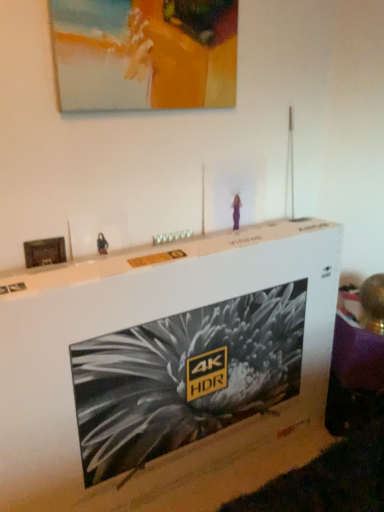
Question: Could matte acrylic painting at upper center, marked as the 1th picture frame in a right-to-left arrangement, be considered to be inside white cardboard box at center?

Choices:
 (A) yes
 (B) no

Answer: (B)

Question: From a real-world perspective, is white cardboard box at center physically below matte acrylic painting at upper center, the 2th picture frame in the left-to-right sequence?

Choices:
 (A) no
 (B) yes

Answer: (B)

Question: Is white cardboard box at center directly adjacent to matte acrylic painting at upper center, the 2th picture frame in the left-to-right sequence?

Choices:
 (A) no
 (B) yes

Answer: (A)

Question: Does white cardboard box at center have a lesser width compared to matte acrylic painting at upper center, the 2th picture frame in the left-to-right sequence?

Choices:
 (A) yes
 (B) no

Answer: (B)

Question: Is the depth of white cardboard box at center greater than that of matte acrylic painting at upper center, positioned as the 1th picture frame in top-to-bottom order?

Choices:
 (A) yes
 (B) no

Answer: (B)

Question: From a real-world perspective, is white cardboard box at center physically located above or below wooden frame at left, which ranks as the 2th picture frame in top-to-bottom order?

Choices:
 (A) below
 (B) above

Answer: (A)

Question: Relative to wooden frame at left, which is counted as the 1th picture frame, starting from the bottom, is white cardboard box at center in front or behind?

Choices:
 (A) behind
 (B) front

Answer: (B)

Question: Visually, is white cardboard box at center positioned to the left or to the right of wooden frame at left, the second picture frame when ordered from right to left?

Choices:
 (A) right
 (B) left

Answer: (A)

Question: Considering the positions of white cardboard box at center and wooden frame at left, which ranks as the 2th picture frame in top-to-bottom order, in the image, is white cardboard box at center taller or shorter than wooden frame at left, which ranks as the 2th picture frame in top-to-bottom order,?

Choices:
 (A) short
 (B) tall

Answer: (B)

Question: Considering their positions, is wooden frame at left, the 1th picture frame viewed from the left, located in front of or behind matte acrylic painting at upper center, the 2th picture frame in the left-to-right sequence?

Choices:
 (A) front
 (B) behind

Answer: (B)

Question: Considering the positions of point (54, 251) and point (182, 38), is point (54, 251) closer or farther from the camera than point (182, 38)?

Choices:
 (A) closer
 (B) farther

Answer: (A)

Question: From a real-world perspective, is wooden frame at left, which is counted as the 1th picture frame, starting from the bottom, above or below matte acrylic painting at upper center, positioned as the 1th picture frame in top-to-bottom order?

Choices:
 (A) below
 (B) above

Answer: (A)

Question: In terms of size, does wooden frame at left, the second picture frame when ordered from right to left, appear bigger or smaller than matte acrylic painting at upper center, positioned as the 1th picture frame in top-to-bottom order?

Choices:
 (A) small
 (B) big

Answer: (A)

Question: Is wooden frame at left, the 1th picture frame viewed from the left, to the left or to the right of white cardboard box at center in the image?

Choices:
 (A) left
 (B) right

Answer: (A)

Question: Considering the positions of wooden frame at left, the second picture frame when ordered from right to left, and white cardboard box at center in the image, is wooden frame at left, the second picture frame when ordered from right to left, wider or thinner than white cardboard box at center?

Choices:
 (A) thin
 (B) wide

Answer: (A)